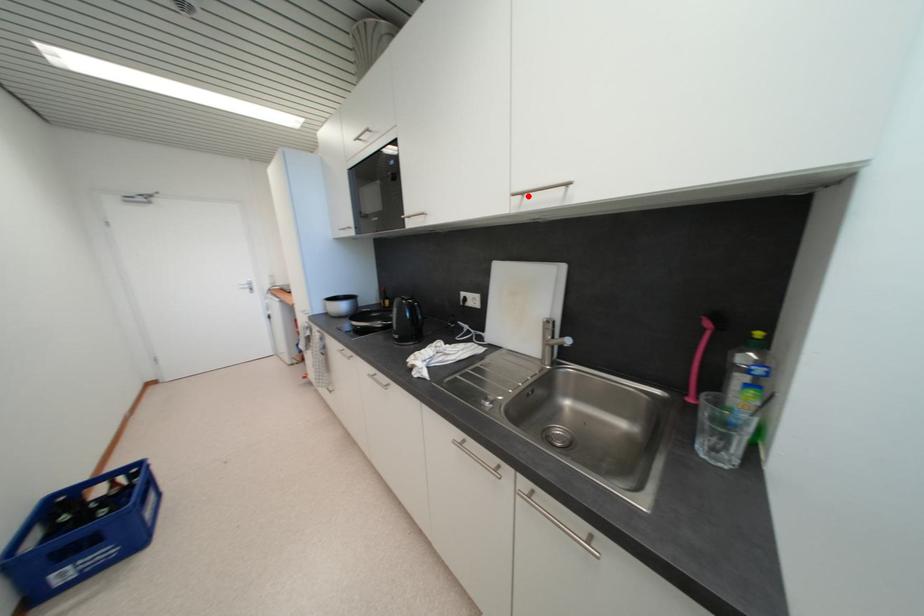
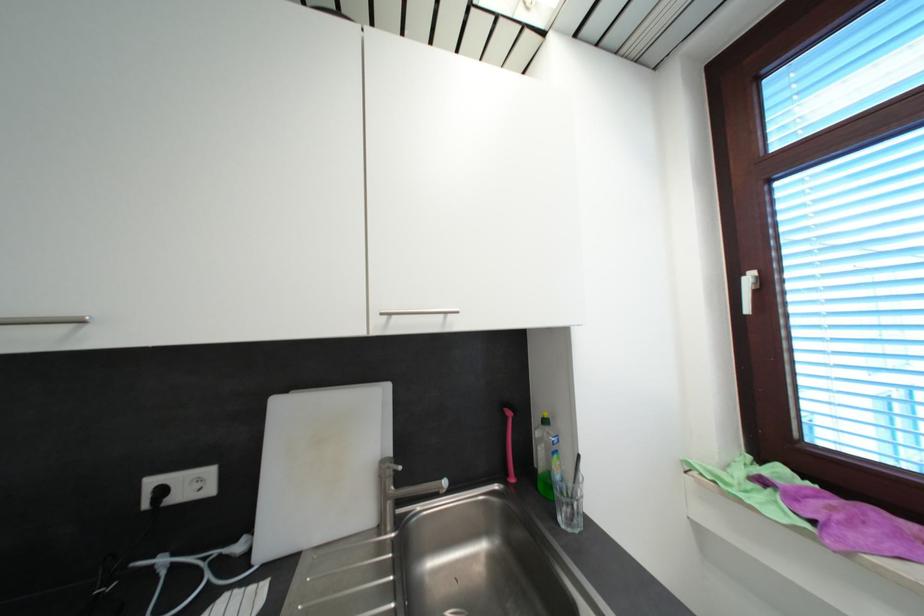
In the second image, find the point that corresponds to the highlighted location in the first image.

(395, 315)